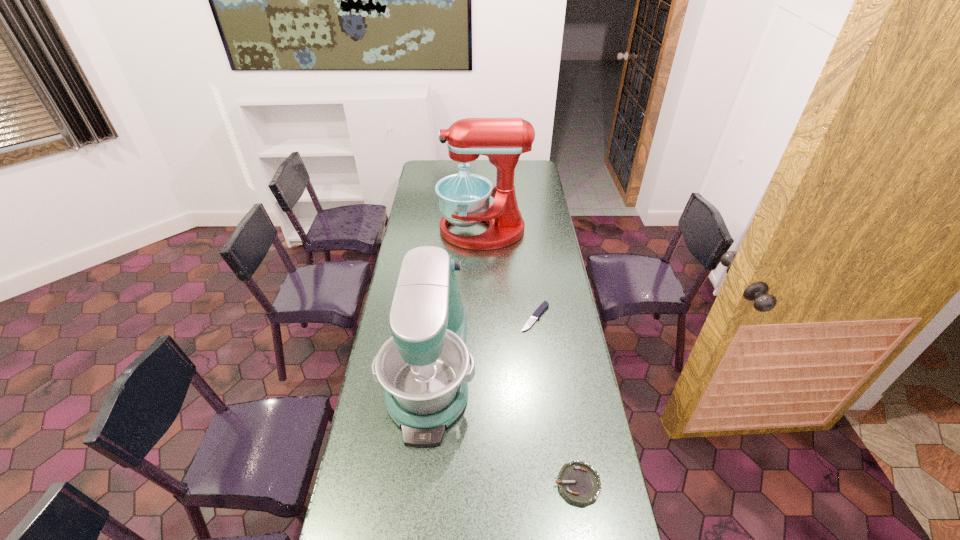
Where is `the tallest object`? Image resolution: width=960 pixels, height=540 pixels. the tallest object is located at coordinates (464, 199).

Locate an element on the screen. This screenshot has height=540, width=960. the farthest object is located at coordinates pyautogui.click(x=464, y=199).

The image size is (960, 540). Identify the location of the nearer mixer. (422, 367).

The height and width of the screenshot is (540, 960). What are the coordinates of `the shorter mixer` in the screenshot? It's located at (422, 367).

Image resolution: width=960 pixels, height=540 pixels. Identify the location of the nearest object. (578, 481).

This screenshot has height=540, width=960. What are the coordinates of `ashtray` in the screenshot? It's located at (578, 481).

The width and height of the screenshot is (960, 540). What are the coordinates of `steak knife` in the screenshot? It's located at (538, 312).

This screenshot has width=960, height=540. What are the coordinates of `free spot located on the front-facing side of the tallest object` in the screenshot? It's located at (428, 230).

At what (x,y) coordinates should I click in order to perform the action: click on vacant space located 0.170m on the front-facing side of the second tallest object. Please return your answer as a coordinate pair (x, y). The height and width of the screenshot is (540, 960). Looking at the image, I should click on (417, 504).

At what (x,y) coordinates should I click in order to perform the action: click on vacant area situated on the back of the nearest object. Please return your answer as a coordinate pair (x, y). Looking at the image, I should click on (566, 416).